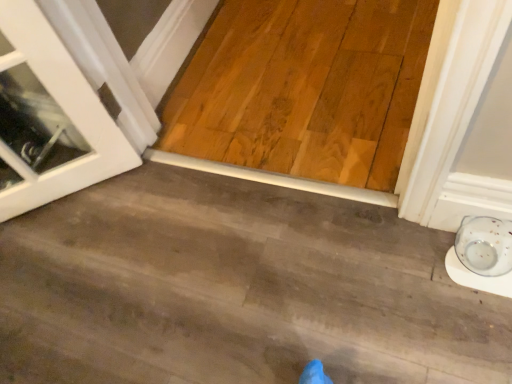
Identify the location of wooden at center. (236, 289).

In order to face wooden at center, should I rotate leftwards or rightwards?

You should look left and rotate roughly 10.121 degrees.

What do you see at coordinates (236, 289) in the screenshot?
I see `wooden at center` at bounding box center [236, 289].

Where is `wooden at center`? This screenshot has width=512, height=384. wooden at center is located at coordinates (236, 289).